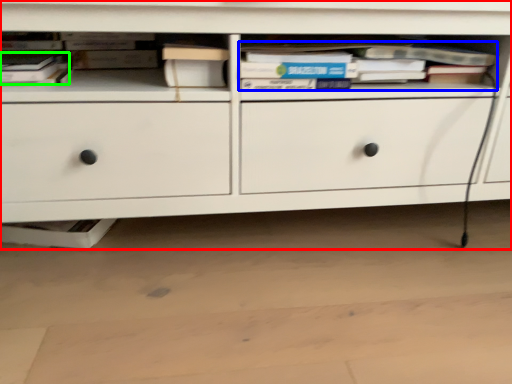
Question: Based on their relative distances, which object is farther from chest of drawers (highlighted by a red box)? Choose from book (highlighted by a blue box) and book (highlighted by a green box).

Choices:
 (A) book
 (B) book

Answer: (B)